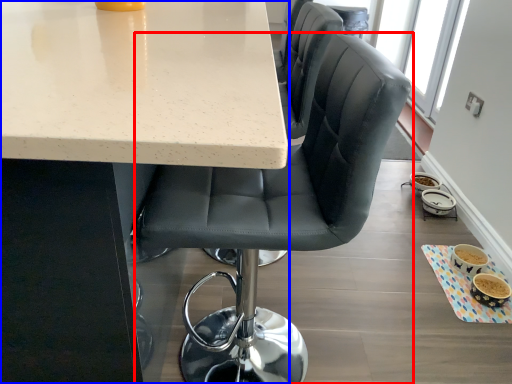
Question: Which object is further to the camera taking this photo, chair (highlighted by a red box) or table (highlighted by a blue box)?

Choices:
 (A) chair
 (B) table

Answer: (A)